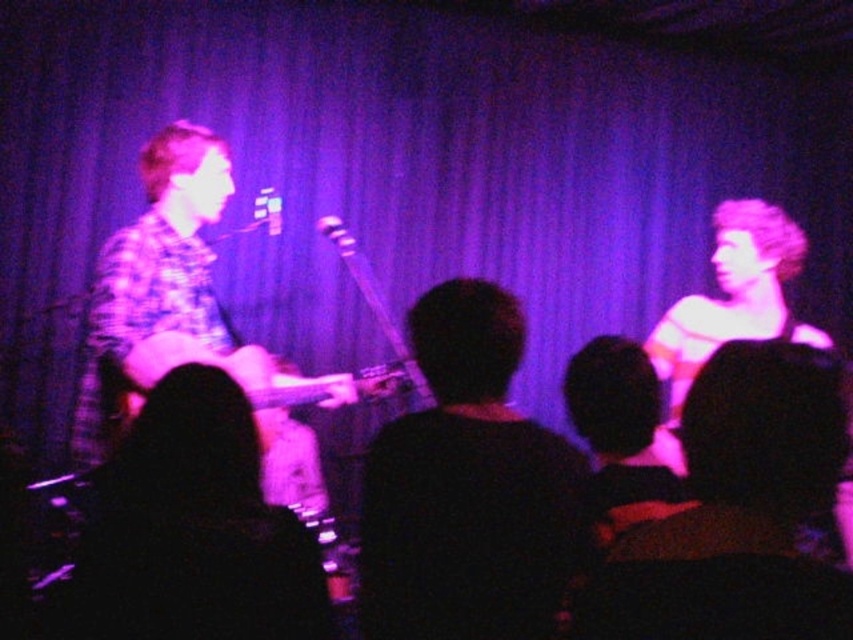
You are a stagehand who needs to place a new microphone stand between the dark brown leather jacket at center and the wooden acoustic guitar at center. Which side of the microphone stand should you place closer to the thinner object?

The dark brown leather jacket at center is thinner than the wooden acoustic guitar at center, so the microphone stand should be placed closer to the dark brown leather jacket at center.

You are a photographer at the back of the venue. You want to take a photo of the wooden acoustic guitar at center without the dark brown leather jacket at center blocking it. Is the jacket currently blocking the view of the guitar?

The dark brown leather jacket at center is in front of the wooden acoustic guitar at center, so yes, the jacket is currently blocking the view of the guitar.